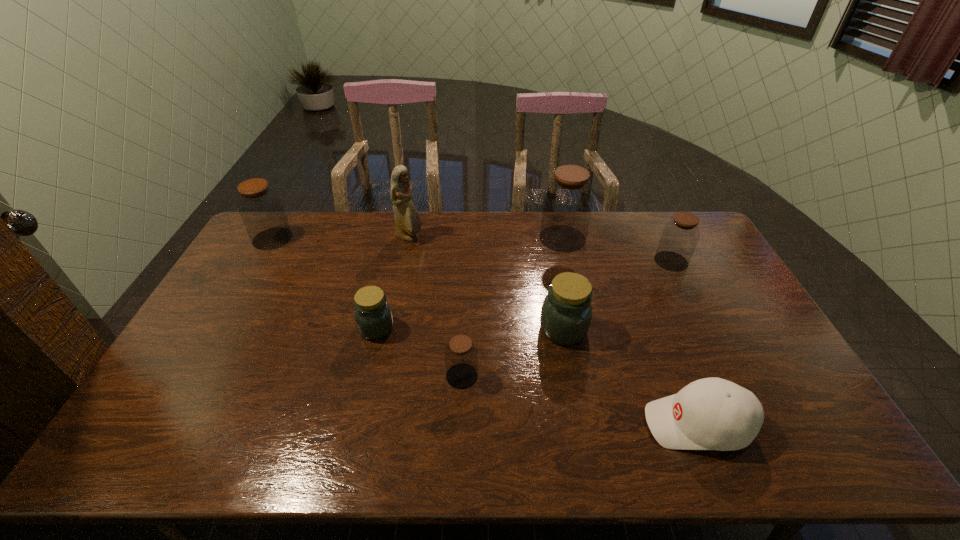
This screenshot has width=960, height=540. I want to click on the smaller green jar, so click(x=373, y=316).

Find the location of a particular element. Image resolution: width=960 pixels, height=540 pixels. the left green jar is located at coordinates (373, 316).

Find the location of a particular element. The height and width of the screenshot is (540, 960). the nearest object is located at coordinates (712, 413).

Locate an element on the screen. This screenshot has height=540, width=960. baseball cap is located at coordinates (712, 413).

Find the location of a particular element. The image size is (960, 540). vacant space located 0.300m on the front-facing side of the figurine is located at coordinates (504, 238).

I want to click on vacant region located 0.160m on the right of the second brown jar from right to left, so click(629, 238).

This screenshot has height=540, width=960. Identify the location of vacant point located 0.100m on the back of the sixth shortest object. (287, 213).

Where is `vacant space positioned 0.320m on the left of the rightmost jar`? vacant space positioned 0.320m on the left of the rightmost jar is located at coordinates (564, 261).

The height and width of the screenshot is (540, 960). I want to click on free point located on the right of the bigger green jar, so click(659, 329).

The width and height of the screenshot is (960, 540). I want to click on free space located 0.090m on the back of the seventh farthest object, so pyautogui.click(x=464, y=338).